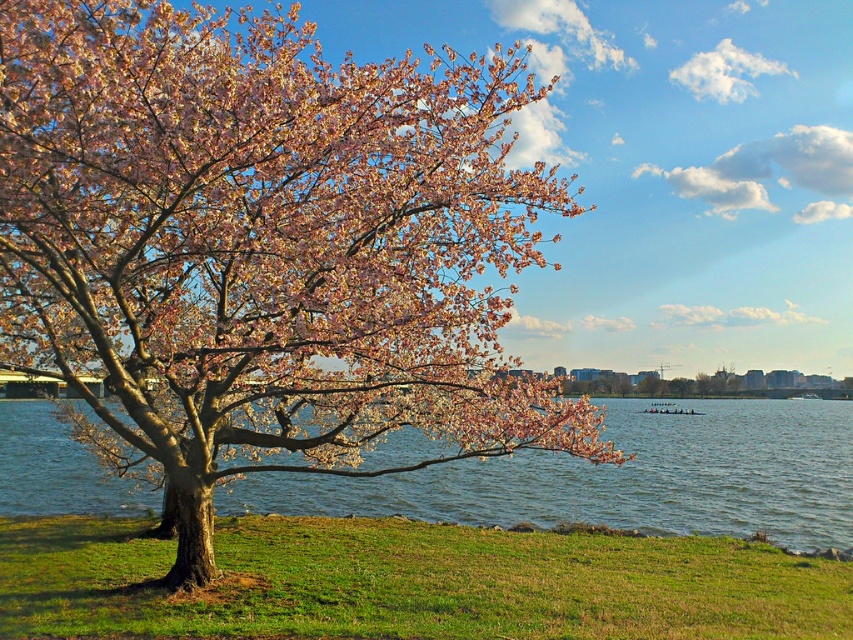
This screenshot has height=640, width=853. I want to click on pink bloom at center, so click(265, 243).

Which is more to the left, pink bloom at center or blue water at center?

pink bloom at center is more to the left.

Describe the element at coordinates (265, 243) in the screenshot. I see `pink bloom at center` at that location.

I want to click on pink bloom at center, so click(265, 243).